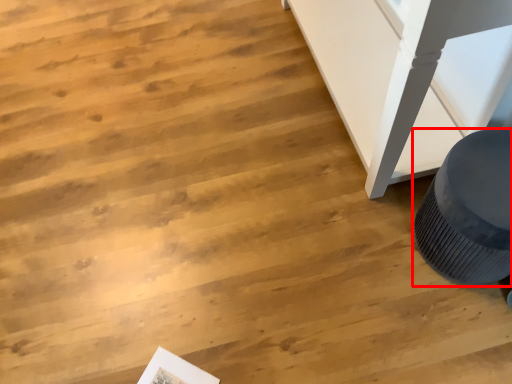
Question: From the image's perspective, where is furniture (annotated by the red box) located in relation to magazine in the image?

Choices:
 (A) below
 (B) above

Answer: (B)